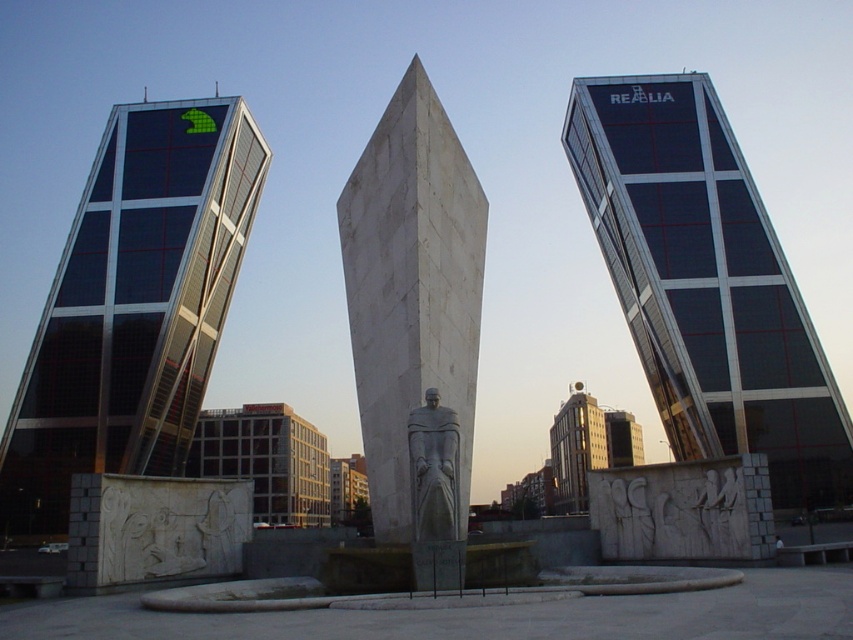
Question: Can you confirm if glassy black skyscraper at left is smaller than gray stone statue at center?

Choices:
 (A) no
 (B) yes

Answer: (A)

Question: Which object appears closest to the camera in this image?

Choices:
 (A) dark glass skyscraper at center
 (B) white marble monument at center
 (C) gray stone statue at center
 (D) glassy black skyscraper at left

Answer: (C)

Question: Is dark glass skyscraper at center positioned before white marble monument at center?

Choices:
 (A) no
 (B) yes

Answer: (A)

Question: Estimate the real-world distances between objects in this image. Which object is farther from the gray stone statue at center?

Choices:
 (A) glassy black skyscraper at left
 (B) dark glass skyscraper at center

Answer: (A)

Question: Which is nearer to the glassy black skyscraper at left?

Choices:
 (A) dark glass skyscraper at center
 (B) white marble monument at center
 (C) gray stone statue at center

Answer: (B)

Question: Can you confirm if dark glass skyscraper at center is positioned to the left of glassy black skyscraper at left?

Choices:
 (A) no
 (B) yes

Answer: (A)